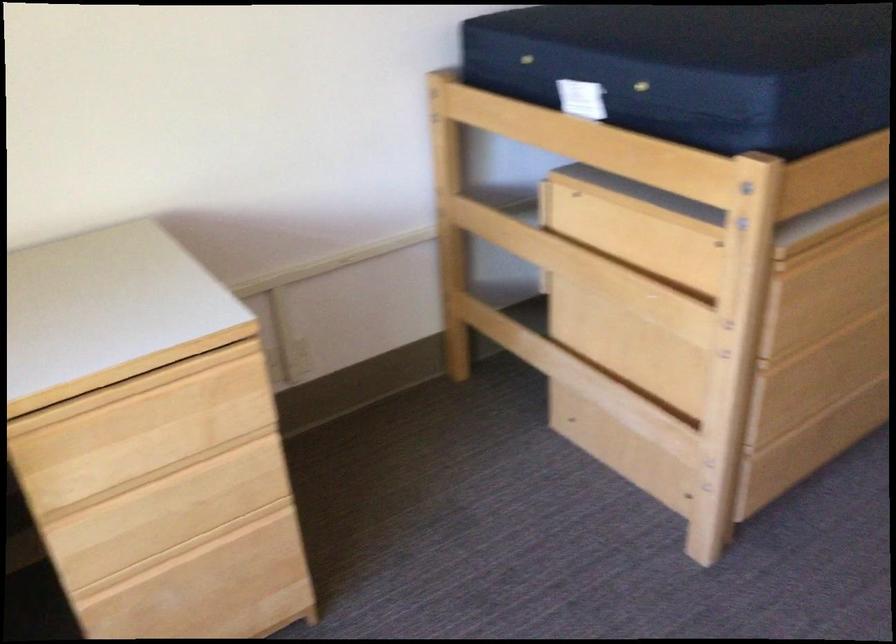
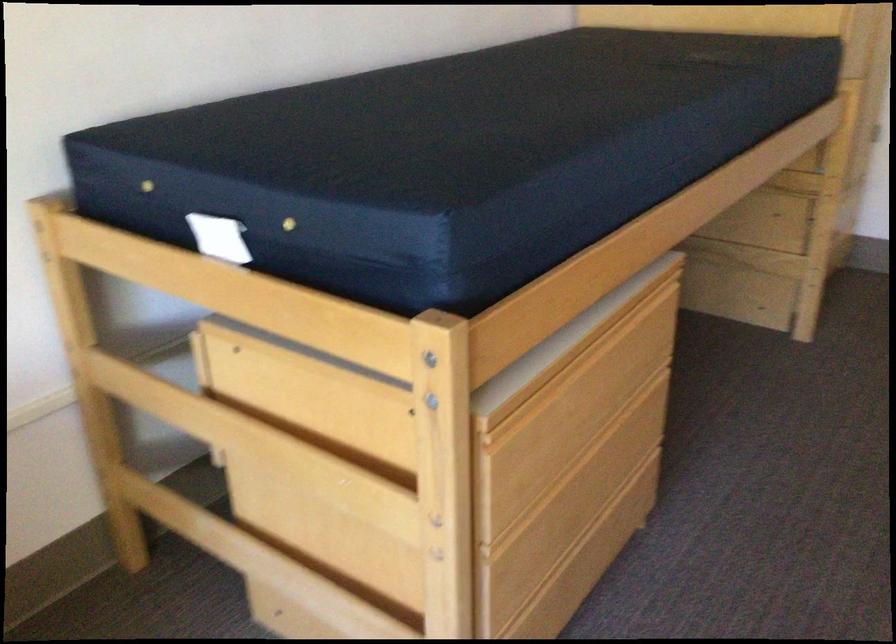
What movement of the cameraman would produce the second image?

The movement direction of the cameraman is right, forward.